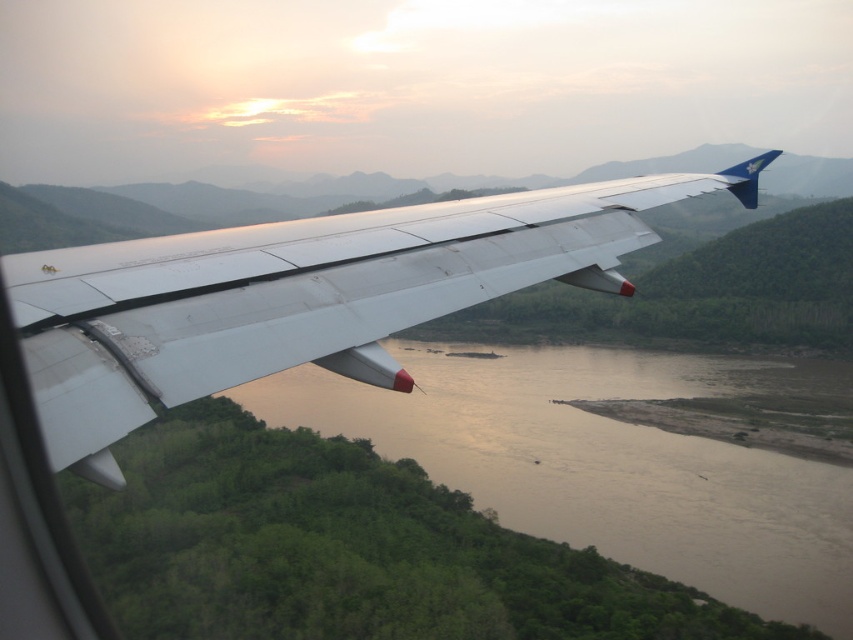
Does white metallic wing at center have a lesser height compared to brown muddy water at center?

Indeed, white metallic wing at center has a lesser height compared to brown muddy water at center.

Between white metallic wing at center and brown muddy water at center, which one appears on the right side from the viewer's perspective?

brown muddy water at center

Does point (167, 296) come behind point (488, 381)?

No, it is not.

Identify the location of white metallic wing at center. The width and height of the screenshot is (853, 640). click(x=300, y=296).